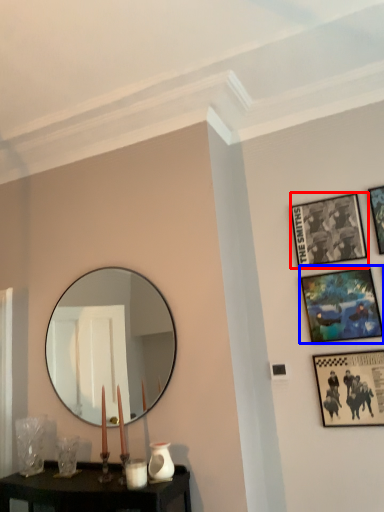
Question: Which of the following is the farthest to the observer, picture frame (highlighted by a red box) or picture frame (highlighted by a blue box)?

Choices:
 (A) picture frame
 (B) picture frame

Answer: (A)